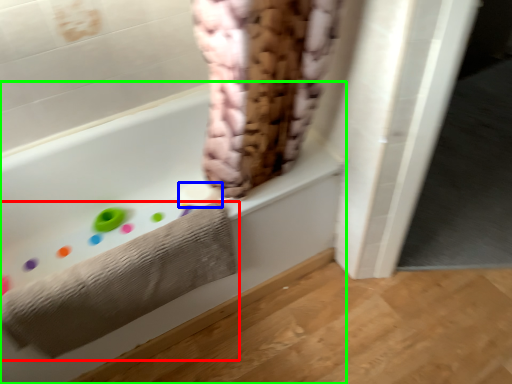
Question: Which object is positioned farthest from towel (highlighted by a red box)? Select from toilet paper (highlighted by a blue box) and bathtub (highlighted by a green box).

Choices:
 (A) toilet paper
 (B) bathtub

Answer: (A)